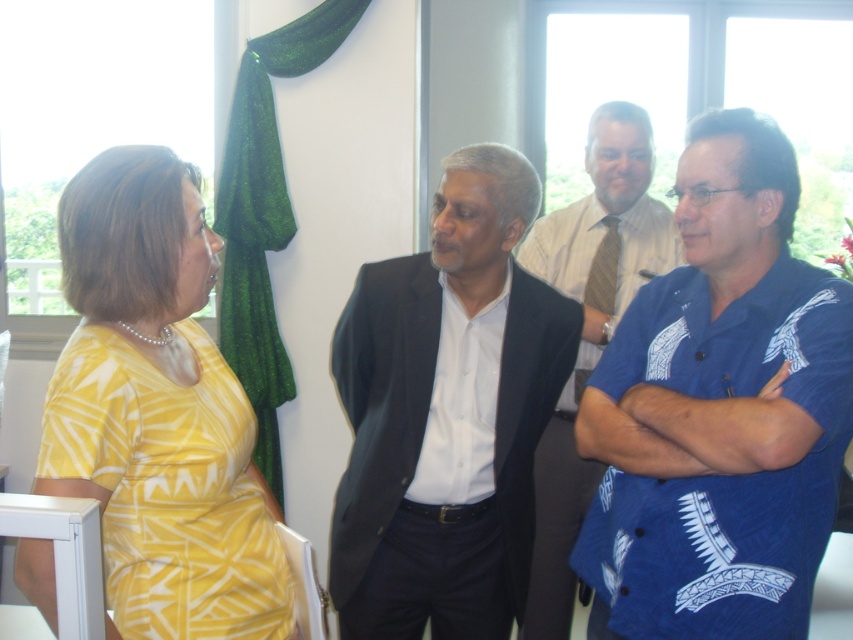
You are standing at the entrance of the room and see the dark gray suit at center and the yellow printed dress at left. Which one is closer to the entrance?

The yellow printed dress at left is closer to the entrance because the dark gray suit at center is to the right of it, meaning the yellow printed dress at left is positioned more towards the entrance side.

You are standing in the room and want to know the relative positions of the dark gray suit at center and the yellow printed dress at left. Which one is positioned lower in the image?

The dark gray suit at center is located below the yellow printed dress at left, so it is positioned lower in the image.

You are standing in the room and want to know which is closer to you between the blue printed shirt at center and the dark gray suit at center. Which one is closer?

The blue printed shirt at center is positioned over dark gray suit at center, so it is closer to you.